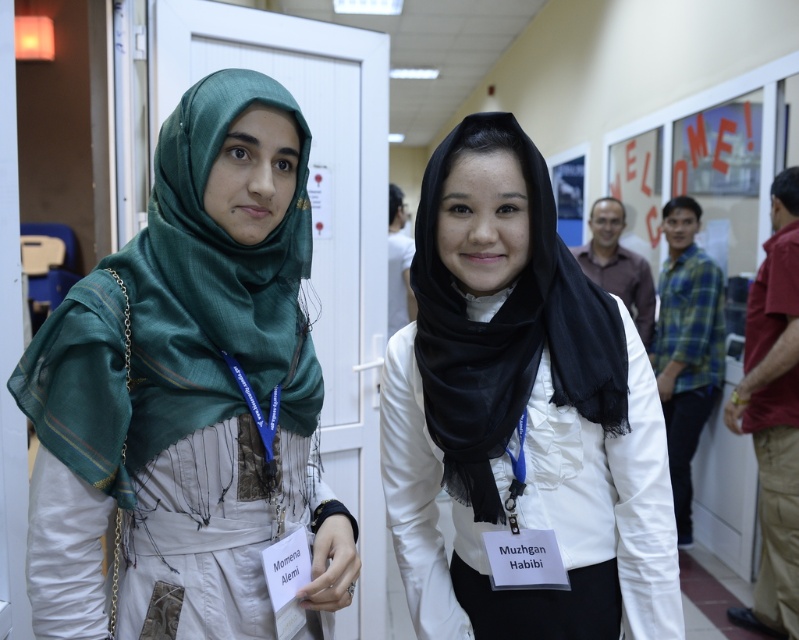
You are organizing a photo shoot and need to ensure that the green silk hijab at left and the black sheer scarf at center are visible in the frame. Given that the camera has a fixed focal length, which scarf should you prioritize positioning closer to the camera to ensure visibility?

The green silk hijab at left is wider than the black sheer scarf at center, so positioning the green silk hijab at left closer to the camera would ensure its visibility due to its larger size.

You are organizing a photo shoot and need to arrange the green silk hijab at left and the black sheer scarf at center in a way that follows the spatial relationship described. Which scarf should be placed to the left of the other?

The green silk hijab at left should be placed to the left of the black sheer scarf at center because the green silk hijab at left is positioned on the left side of black sheer scarf at center.

You are organizing a photo shoot and need to ensure that the green silk hijab at left and the black sheer scarf at center are visible in the frame. Given their sizes, which one should you focus on to ensure both are clearly visible?

The green silk hijab at left is larger than the black sheer scarf at center, so focusing on the larger green silk hijab at left will help ensure both are visible in the frame.